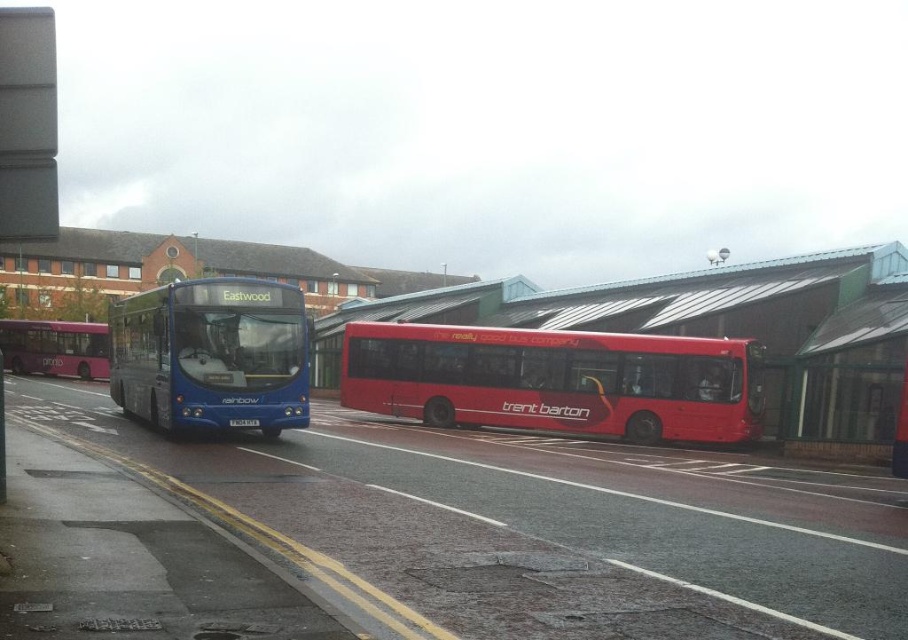
Question: Can you confirm if matte blue bus at left is wider than matte purple bus at left?

Choices:
 (A) yes
 (B) no

Answer: (B)

Question: Considering the real-world distances, which object is closest to the matte purple bus at left?

Choices:
 (A) shiny red bus at center
 (B) matte blue bus at left

Answer: (A)

Question: Does shiny red bus at center have a greater width compared to matte purple bus at left?

Choices:
 (A) no
 (B) yes

Answer: (B)

Question: Which object appears closest to the camera in this image?

Choices:
 (A) matte purple bus at left
 (B) shiny red bus at center

Answer: (B)

Question: Is matte blue bus at left thinner than matte purple bus at left?

Choices:
 (A) yes
 (B) no

Answer: (A)

Question: Which object appears closest to the camera in this image?

Choices:
 (A) matte purple bus at left
 (B) matte blue bus at left
 (C) shiny red bus at center

Answer: (B)